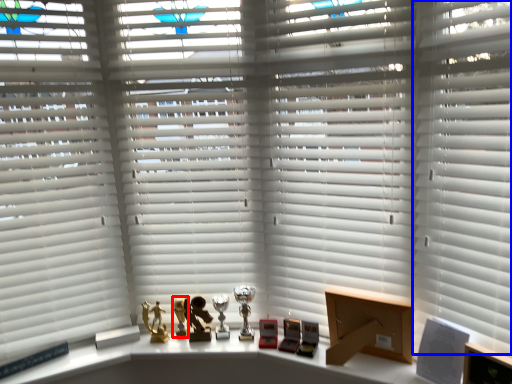
Question: Which of the following is the farthest to the observer, miniature (highlighted by a red box) or shutter (highlighted by a blue box)?

Choices:
 (A) miniature
 (B) shutter

Answer: (A)